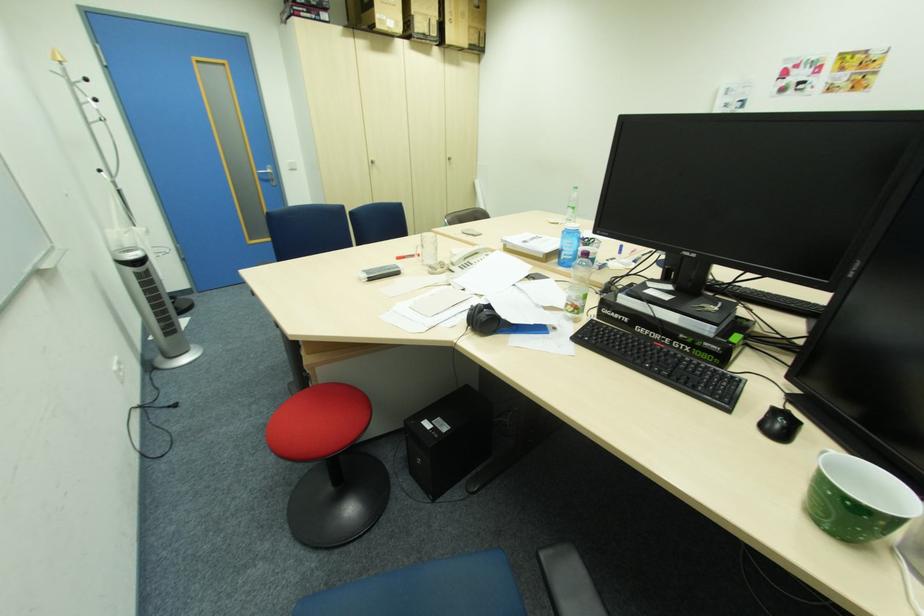
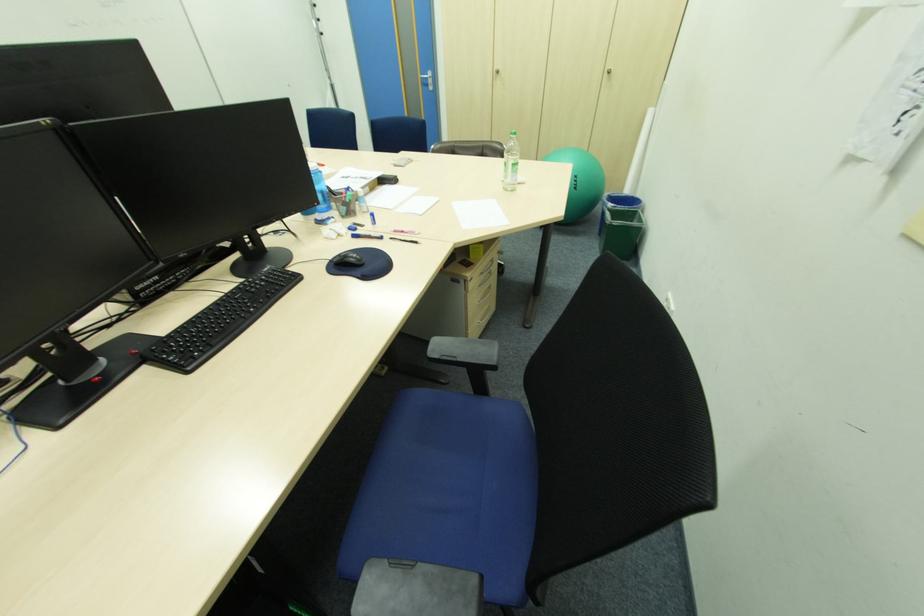
The point at (x=264, y=174) is marked in the first image. Where is the corresponding point in the second image?

(428, 79)